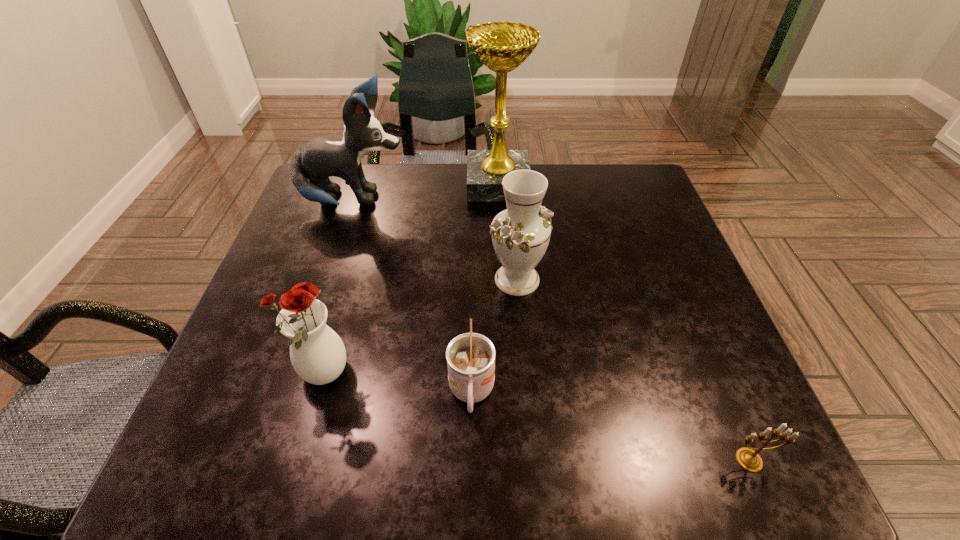
At what (x,y) coordinates should I click in order to perform the action: click on free space located 0.390m on the front-facing side of the award. Please return your answer as a coordinate pair (x, y). This screenshot has width=960, height=540. Looking at the image, I should click on (330, 184).

The width and height of the screenshot is (960, 540). I want to click on free space located on the front-facing side of the second tallest object, so click(x=455, y=201).

Image resolution: width=960 pixels, height=540 pixels. I want to click on vacant position located on the front of the fourth nearest object, so tap(530, 433).

This screenshot has height=540, width=960. Identify the location of free space located on the left of the nearer vase. point(251,375).

Identify the location of free location located on the side with the handle of the cup. (470, 457).

Where is `vacant space located on the left of the candelabrum`? The height and width of the screenshot is (540, 960). vacant space located on the left of the candelabrum is located at coordinates (671, 460).

This screenshot has height=540, width=960. In order to click on award that is at the far edge in this screenshot , I will do `click(502, 46)`.

Where is `puppy present at the far edge`? The width and height of the screenshot is (960, 540). puppy present at the far edge is located at coordinates (313, 163).

This screenshot has height=540, width=960. Identify the location of cup located at the near edge. (470, 357).

The width and height of the screenshot is (960, 540). Find the location of `candelabrum that is at the near edge`. candelabrum that is at the near edge is located at coordinates tap(748, 459).